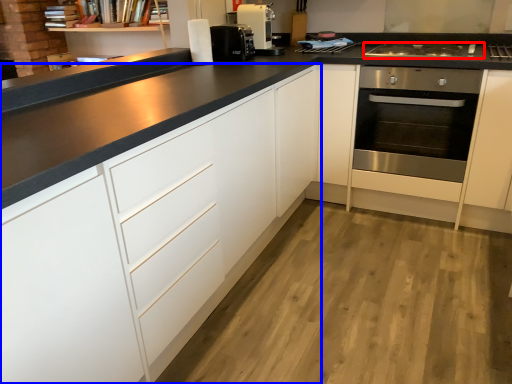
Question: Which point is closer to the camera, gas stove (highlighted by a red box) or cabinetry (highlighted by a blue box)?

Choices:
 (A) gas stove
 (B) cabinetry

Answer: (B)